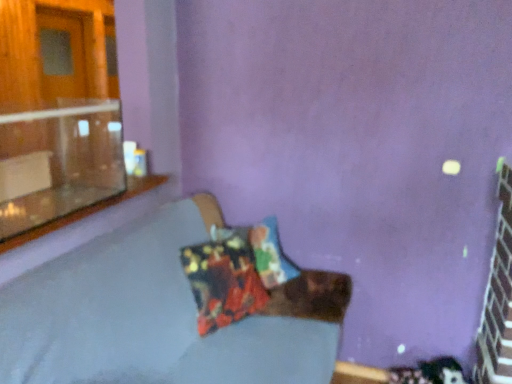
Question: Can you confirm if printed fabric pillow at center is bigger than clear glass window sill at upper left?

Choices:
 (A) no
 (B) yes

Answer: (B)

Question: From a real-world perspective, is printed fabric pillow at center located beneath clear glass window sill at upper left?

Choices:
 (A) yes
 (B) no

Answer: (A)

Question: Is printed fabric pillow at center oriented away from clear glass window sill at upper left?

Choices:
 (A) yes
 (B) no

Answer: (B)

Question: Can clear glass window sill at upper left be found inside printed fabric pillow at center?

Choices:
 (A) no
 (B) yes

Answer: (A)

Question: Can you confirm if printed fabric pillow at center is taller than clear glass window sill at upper left?

Choices:
 (A) no
 (B) yes

Answer: (B)

Question: Does printed fabric pillow at center turn towards clear glass window sill at upper left?

Choices:
 (A) yes
 (B) no

Answer: (B)

Question: From a real-world perspective, is transparent glass window at upper left on top of textured fabric couch at center?

Choices:
 (A) yes
 (B) no

Answer: (A)

Question: Does transparent glass window at upper left have a larger size compared to textured fabric couch at center?

Choices:
 (A) no
 (B) yes

Answer: (A)

Question: From a real-world perspective, is transparent glass window at upper left located beneath textured fabric couch at center?

Choices:
 (A) yes
 (B) no

Answer: (B)

Question: Can you see transparent glass window at upper left touching textured fabric couch at center?

Choices:
 (A) yes
 (B) no

Answer: (B)

Question: From the image's perspective, is transparent glass window at upper left on textured fabric couch at center?

Choices:
 (A) yes
 (B) no

Answer: (A)

Question: Is transparent glass window at upper left facing away from textured fabric couch at center?

Choices:
 (A) yes
 (B) no

Answer: (B)

Question: From a real-world perspective, is printed fabric pillow at center below transparent glass window at upper left?

Choices:
 (A) yes
 (B) no

Answer: (A)